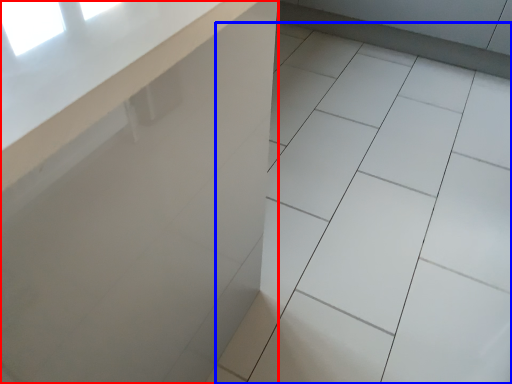
Question: Which object is closer to the camera taking this photo, counter (highlighted by a red box) or ceramic tile (highlighted by a blue box)?

Choices:
 (A) counter
 (B) ceramic tile

Answer: (A)